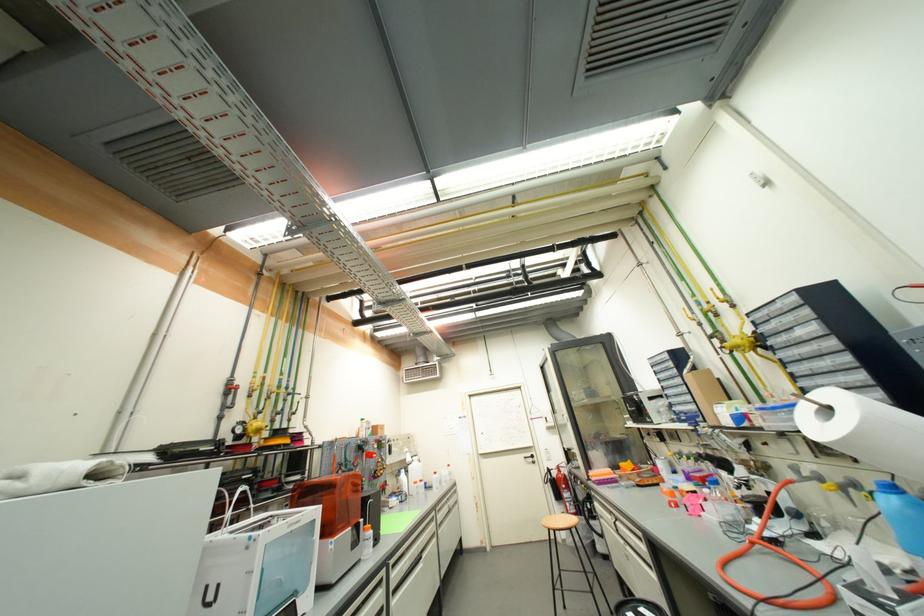
Where would you squeez the extinguisher lever? Please return your answer as a coordinate pair (x, y).

(578, 490)